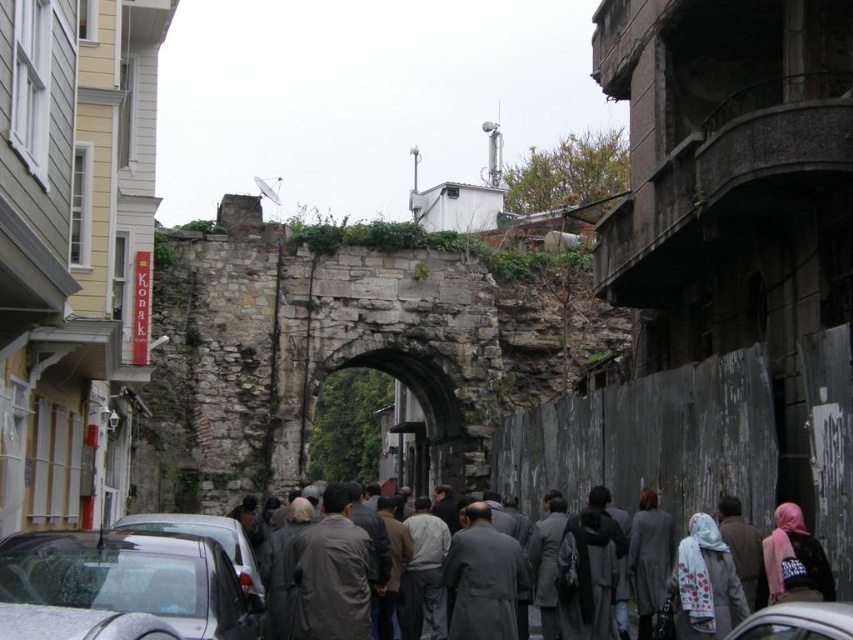
You are a photographer standing in the middle of the street. You want to take a photo of both the shiny black car at lower left and the rustic stone archway at center. Based on their heights, which object should you focus on first if you want to ensure both are fully visible in the frame?

The shiny black car at lower left has a lesser height compared to the rustic stone archway at center. To ensure both are fully visible, focus on the rustic stone archway at center first since it is taller and requires more vertical space in the frame.

You are standing in a city square and see the rustic stone archway at center. If you want to take a photo of it without any modern buildings in the background, which direction should you face?

You should face the side of rustic stone archway at center that has the traditional architectural style since the modern buildings are on the other side, and the archway is 92.75 meters away from you.

You are a pedestrian standing on the street and see the white floral scarf at center and the white glossy car at lower center. Which object is closer to the left side of the street?

The white floral scarf at center is positioned on the left side of the white glossy car at lower center, so it is closer to the left side of the street.